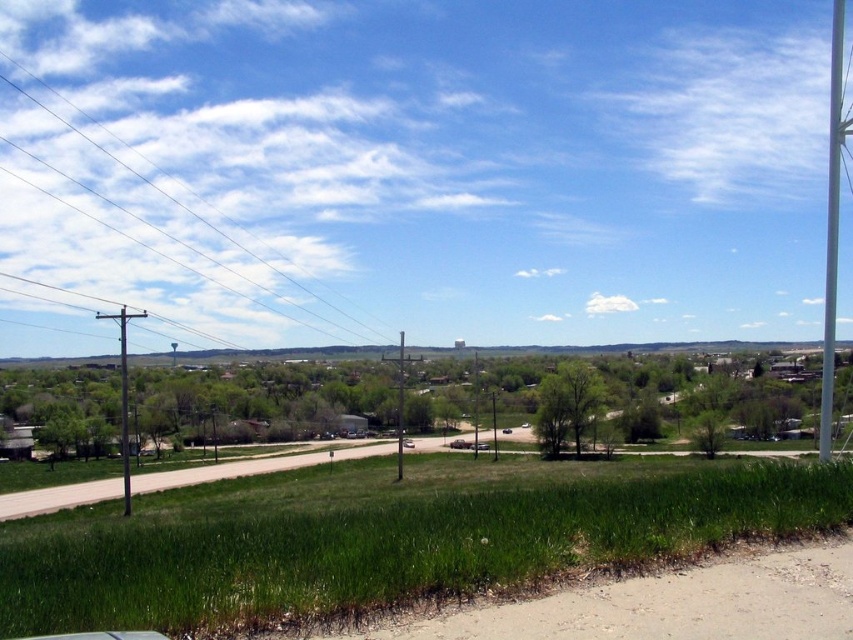
Is point (207, 227) less distant than point (125, 380)?

That is False.

Between smooth wire at upper left and brown wooden telegraph pole at left, which one is positioned higher?

Positioned higher is smooth wire at upper left.

Is point (183, 208) positioned in front of point (120, 454)?

No, it is behind (120, 454).

Where is `smooth wire at upper left`? The image size is (853, 640). smooth wire at upper left is located at coordinates (183, 205).

Is point (115, 317) farther from viewer compared to point (402, 449)?

No, (115, 317) is in front of (402, 449).

Describe the element at coordinates (123, 396) in the screenshot. I see `brown wooden telegraph pole at left` at that location.

Where is `brown wooden telegraph pole at left`? Image resolution: width=853 pixels, height=640 pixels. brown wooden telegraph pole at left is located at coordinates (123, 396).

Identify the location of brown wooden telegraph pole at left. 123,396.

This screenshot has width=853, height=640. Describe the element at coordinates (123, 396) in the screenshot. I see `brown wooden telegraph pole at left` at that location.

Does brown wooden telegraph pole at left appear under metallic gray utility pole at left?

Yes, brown wooden telegraph pole at left is below metallic gray utility pole at left.

Does point (112, 314) come behind point (125, 362)?

No, (112, 314) is in front of (125, 362).

Where is `brown wooden telegraph pole at left`? This screenshot has width=853, height=640. brown wooden telegraph pole at left is located at coordinates (123, 396).